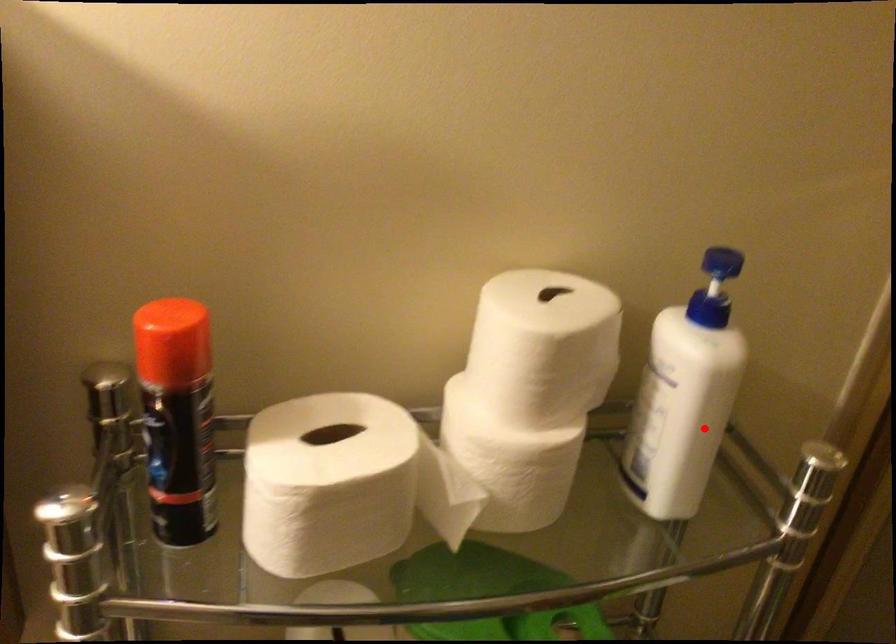
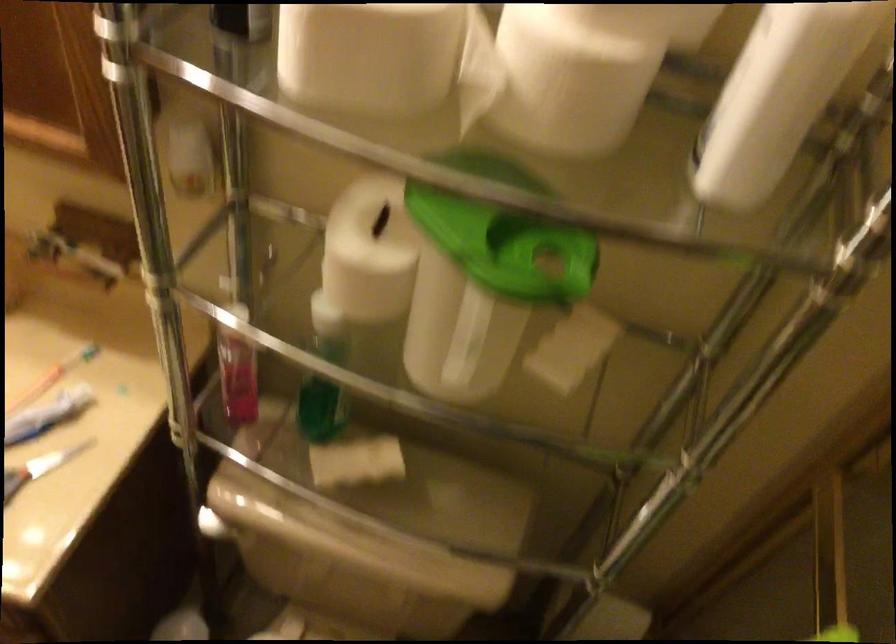
Question: I am providing you with two images of the same scene from different viewpoints. A red point is shown in image1. For the corresponding object point in image2, is it positioned nearer or farther from the camera?

Choices:
 (A) Nearer
 (B) Farther

Answer: (A)